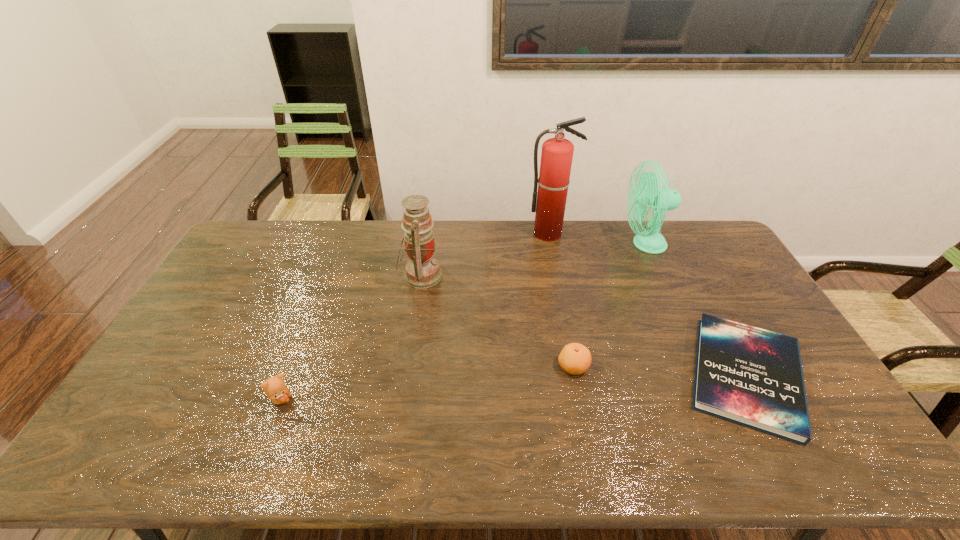
Locate an element on the screen. fire extinguisher is located at coordinates point(557,153).

This screenshot has width=960, height=540. I want to click on fan, so click(648, 192).

Find the location of a particular element. the fifth object from right to left is located at coordinates (422, 270).

The width and height of the screenshot is (960, 540). I want to click on the third shortest object, so click(275, 388).

Where is `the leftmost object`? Image resolution: width=960 pixels, height=540 pixels. the leftmost object is located at coordinates (275, 388).

Where is `the fifth tallest object`? the fifth tallest object is located at coordinates (574, 358).

I want to click on hardback book, so click(750, 376).

Where is `blank space located with the nozzle and gauge on the fire extinguisher`? blank space located with the nozzle and gauge on the fire extinguisher is located at coordinates (564, 306).

I want to click on free space located in front of the fan to blow air, so click(x=522, y=244).

Find the location of a particular element. This screenshot has width=960, height=540. free space located in front of the fan to blow air is located at coordinates (551, 244).